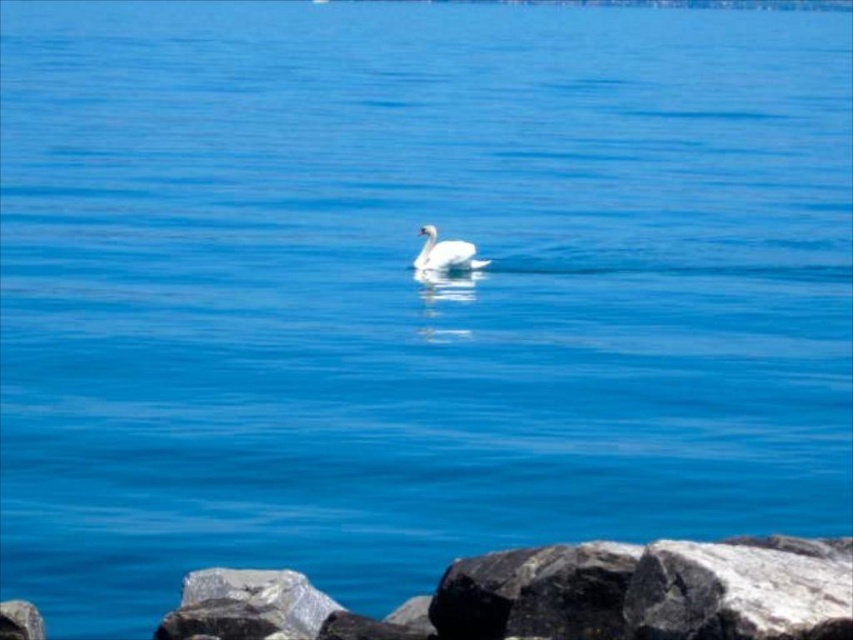
You are a photographer standing on the edge of the water and want to take a picture of the gray rock at lower center and the white glossy swan at center. Which object will appear closer to you in the photo?

The gray rock at lower center will appear closer to you in the photo because it is positioned in front of the white glossy swan at center.

You are standing on the edge of the water and see the gray rock at lower center and the white glossy swan at center. Which object is smaller in size?

The gray rock at lower center is smaller in size compared to the white glossy swan at center.

You are standing at the edge of the water and see a point marked at coordinates point (247, 605). What is the nearest object to this point?

The point (247, 605) is on gray rock at lower center, so the nearest object to this point is the gray rock at lower center.